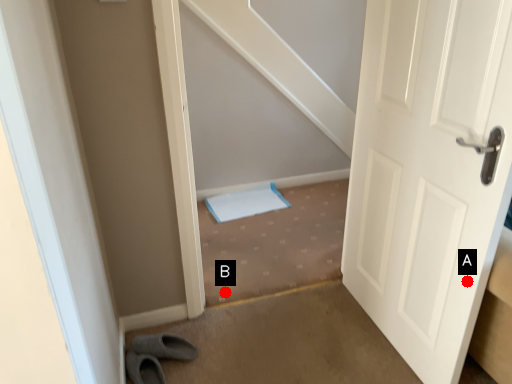
Question: Two points are circled on the image, labeled by A and B beside each circle. Among these points, which one is nearest to the camera?

Choices:
 (A) A is closer
 (B) B is closer

Answer: (A)